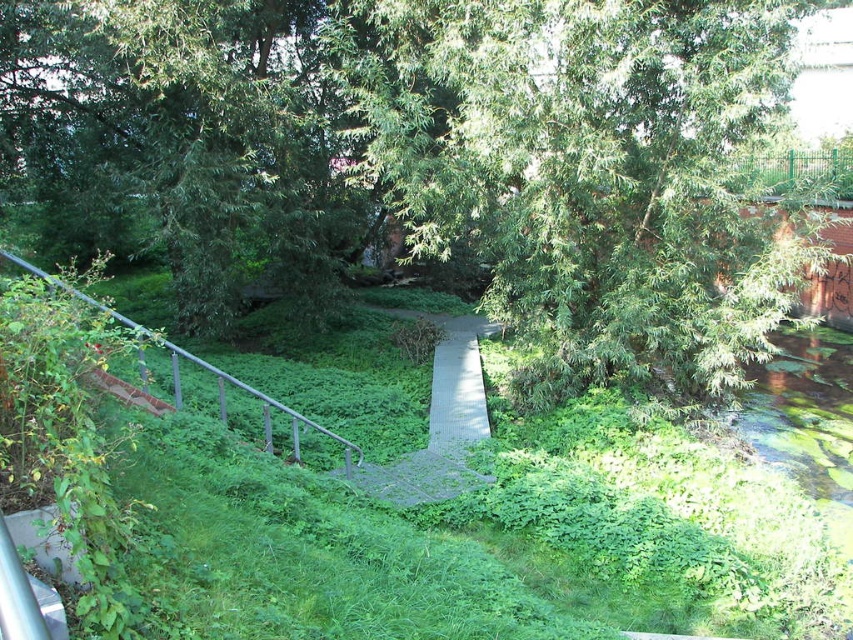
You are standing at the starting point of the pathway and see two points marked on the path ahead. The first point is at coordinates point (490,10) and the second is at point (122,316). Which point will you encounter first as you walk along the pathway?

You will encounter point (490,10) first because it is in front of point (122,316) along the pathway.

You are standing at the point marked by point [469,540] which is green leafy grass at center. You want to walk to the metal railing on the left side of the pathway. Which direction should you face to walk towards the metal railing on the left side of the pathway?

You should face to the left side of the pathway to walk towards the metal railing on the left side of the pathway because the metal railing is located on the left side of the pathway, and you are currently at the green leafy grass at center.